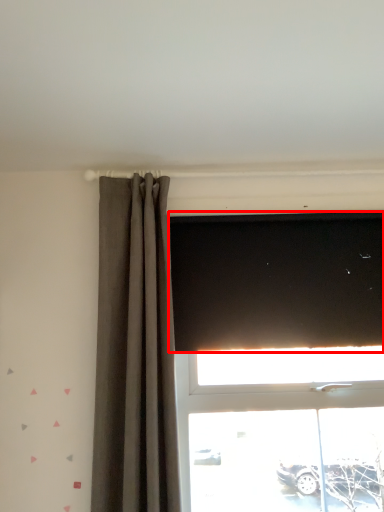
Question: From the image, what is the correct spatial relationship of blind (annotated by the red box) in relation to curtain?

Choices:
 (A) left
 (B) right

Answer: (B)